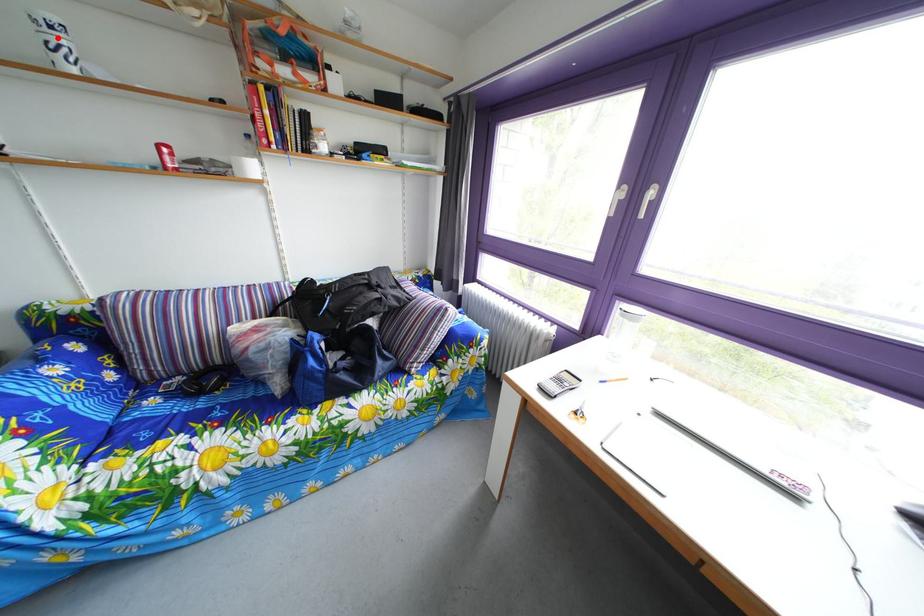
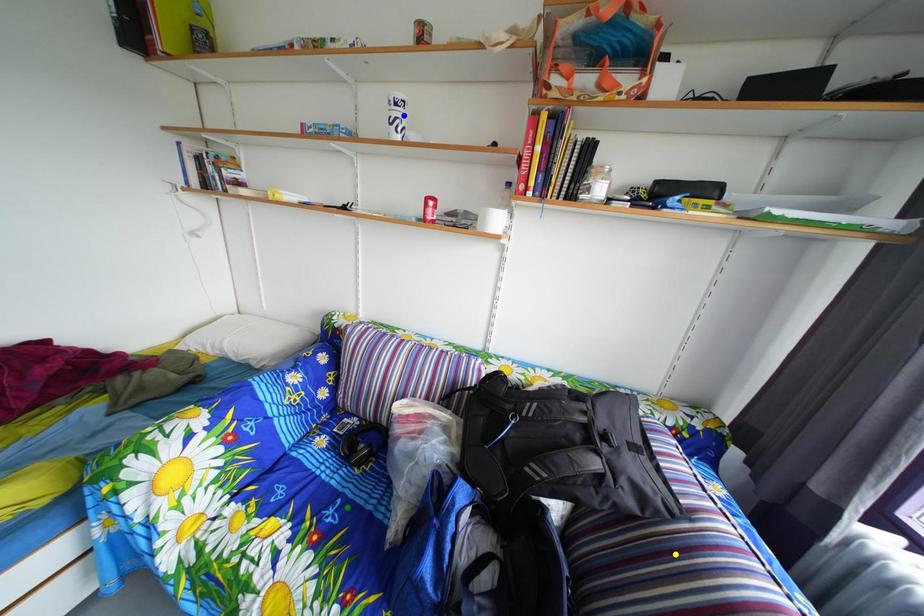
Question: I am providing you with two images of the same scene from different viewpoints. A red point is marked on the first image. You are given multiple points on the second image. Can you choose the point in image 2 that corresponds to the point in image 1?

Choices:
 (A) green point
 (B) blue point
 (C) yellow point

Answer: (B)